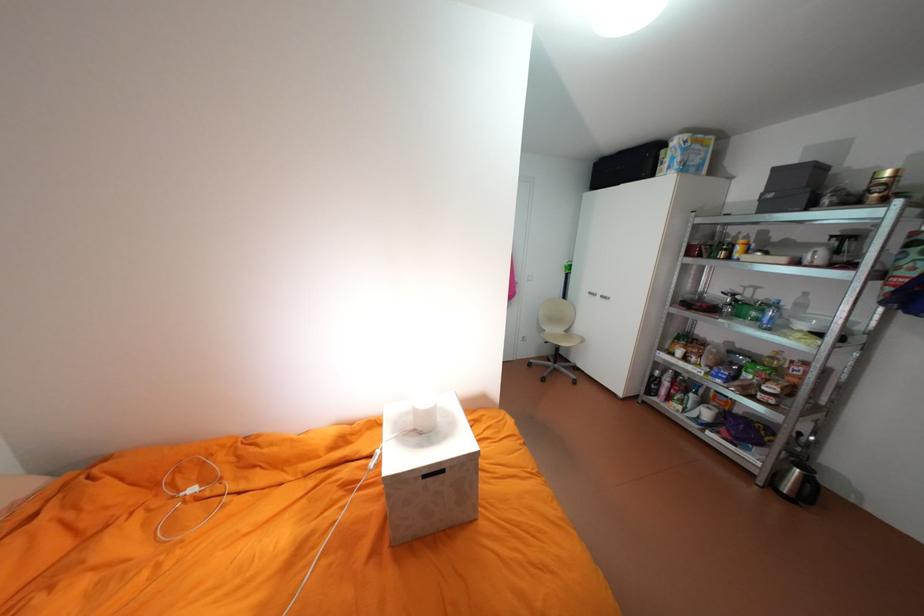
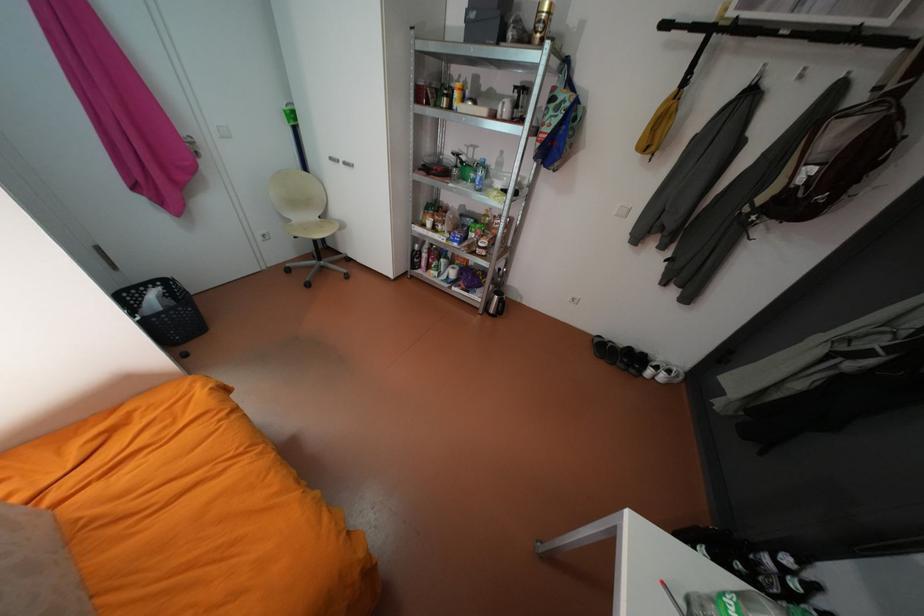
In the second image, find the point that corresponds to point (860, 200) in the first image.

(533, 39)